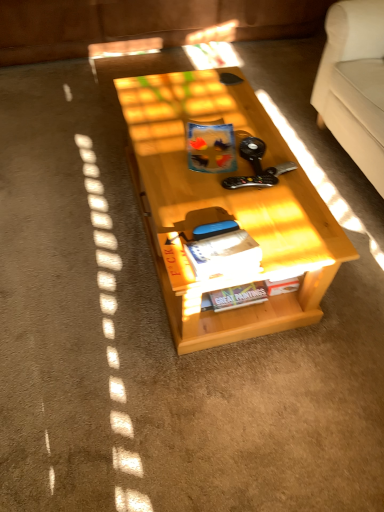
Locate an element on the screen. The image size is (384, 512). free spot to the left of light wood table at center is located at coordinates (71, 215).